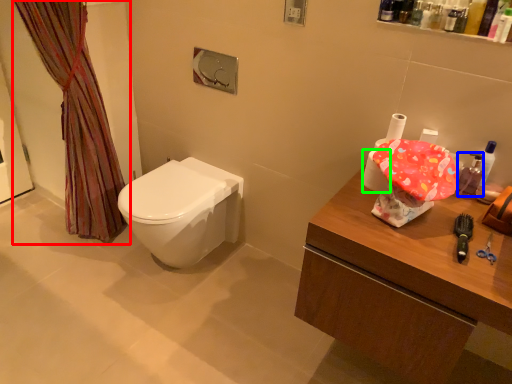
Question: Which is farther away from curtain (highlighted by a red box)? mouthwash (highlighted by a blue box) or toilet paper (highlighted by a green box)?

Choices:
 (A) mouthwash
 (B) toilet paper

Answer: (A)